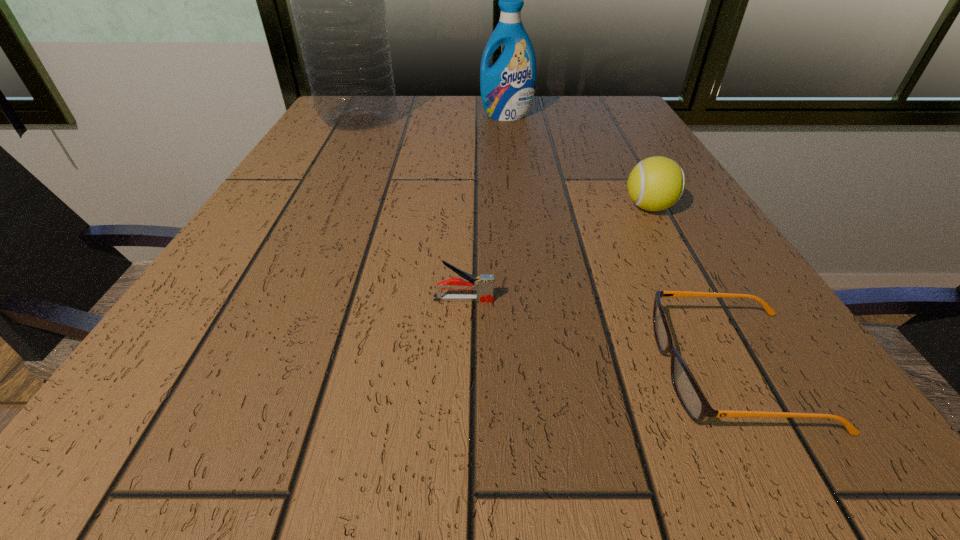
You are a GUI agent. You are given a task and a screenshot of the screen. Output one action in this format:
    pyautogui.click(x=<x>, y=<y>)
    Task: Click on the vacant region located on the front-facing side of the detergent
    
    Given the screenshot: What is the action you would take?
    pyautogui.click(x=514, y=170)

Find the location of `vacant space located on the front of the third farthest object`. vacant space located on the front of the third farthest object is located at coordinates (670, 247).

I want to click on vacant region located 0.150m on the handle side of the stapler, so click(605, 299).

This screenshot has width=960, height=540. I want to click on free location located 0.100m on the front-facing side of the shortest object, so click(573, 369).

This screenshot has width=960, height=540. In order to click on free region located on the front-facing side of the shortest object in this screenshot , I will do `click(313, 369)`.

Identify the location of free point located 0.270m on the front-facing side of the shortest object. (426, 369).

Image resolution: width=960 pixels, height=540 pixels. Identify the location of water jug located at the far edge. (337, 0).

At what (x,y) coordinates should I click in order to perform the action: click on detergent that is at the far edge. Please return your answer as a coordinate pair (x, y). Looking at the image, I should click on (507, 87).

This screenshot has width=960, height=540. I want to click on object situated at the near edge, so click(x=694, y=403).

Where is `object that is positioned at the left edge`? Image resolution: width=960 pixels, height=540 pixels. object that is positioned at the left edge is located at coordinates (337, 0).